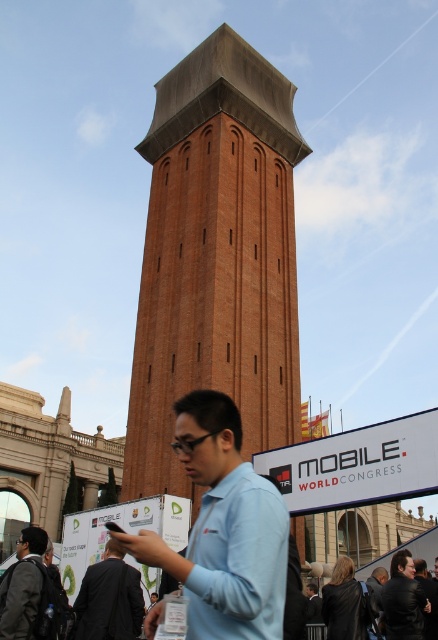
Question: In this image, where is matte blue shirt at center located relative to black leather jacket at lower right?

Choices:
 (A) above
 (B) below

Answer: (B)

Question: Which of these objects is positioned closest to the black leather jacket at lower right?

Choices:
 (A) matte blue shirt at center
 (B) light blue shirt at center

Answer: (A)

Question: Among these points, which one is nearest to the camera?

Choices:
 (A) (163, 204)
 (B) (159, 563)
 (C) (388, 608)
 (D) (24, 616)

Answer: (B)

Question: Which point is farther to the camera?

Choices:
 (A) (190, 404)
 (B) (102, 576)

Answer: (B)

Question: Is light blue shirt at center closer to the viewer compared to matte blue shirt at center?

Choices:
 (A) no
 (B) yes

Answer: (B)

Question: Is the position of brown brick tower at center less distant than that of dark gray suit at center?

Choices:
 (A) no
 (B) yes

Answer: (A)